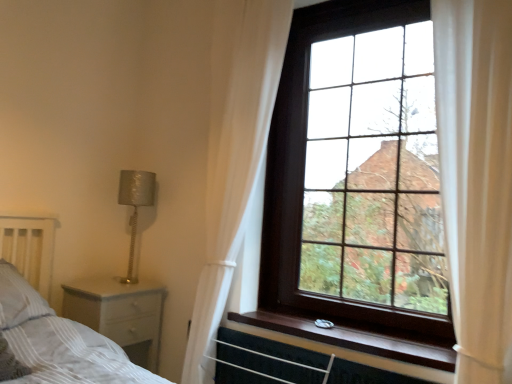
Question: Is white sheer curtain at right, the second curtain from the back, a part of white striped pillow at lower left?

Choices:
 (A) no
 (B) yes

Answer: (A)

Question: Is white striped pillow at lower left further to camera compared to white sheer curtain at right, the second curtain from the back?

Choices:
 (A) no
 (B) yes

Answer: (B)

Question: Does white striped pillow at lower left have a greater height compared to white sheer curtain at right, the second curtain from the back?

Choices:
 (A) yes
 (B) no

Answer: (B)

Question: Can you confirm if white striped pillow at lower left is shorter than white sheer curtain at right, positioned as the first curtain in front-to-back order?

Choices:
 (A) yes
 (B) no

Answer: (A)

Question: Is white striped pillow at lower left to the right of white sheer curtain at right, positioned as the first curtain in front-to-back order, from the viewer's perspective?

Choices:
 (A) no
 (B) yes

Answer: (A)

Question: From the image's perspective, is white striped pillow at lower left under white sheer curtain at right, placed as the 1th curtain when sorted from right to left?

Choices:
 (A) no
 (B) yes

Answer: (B)

Question: Considering the relative sizes of white sheer curtain at right, placed as the 1th curtain when sorted from right to left, and white sheer curtain at upper right, placed as the 2th curtain when sorted from right to left, in the image provided, is white sheer curtain at right, placed as the 1th curtain when sorted from right to left, thinner than white sheer curtain at upper right, placed as the 2th curtain when sorted from right to left,?

Choices:
 (A) yes
 (B) no

Answer: (A)

Question: Does white sheer curtain at right, placed as the 1th curtain when sorted from right to left, appear on the left side of white sheer curtain at upper right, which is the first curtain from back to front?

Choices:
 (A) yes
 (B) no

Answer: (B)

Question: From a real-world perspective, is white sheer curtain at right, placed as the 1th curtain when sorted from right to left, located higher than white sheer curtain at upper right, which is the first curtain from back to front?

Choices:
 (A) yes
 (B) no

Answer: (A)

Question: Does white sheer curtain at right, the second curtain from the back, turn towards white sheer curtain at upper right, placed as the 2th curtain when sorted from right to left?

Choices:
 (A) yes
 (B) no

Answer: (B)

Question: Considering the relative sizes of white sheer curtain at right, which is counted as the 2th curtain, starting from the left, and white sheer curtain at upper right, arranged as the 2th curtain when viewed from the front, in the image provided, is white sheer curtain at right, which is counted as the 2th curtain, starting from the left, shorter than white sheer curtain at upper right, arranged as the 2th curtain when viewed from the front,?

Choices:
 (A) no
 (B) yes

Answer: (B)

Question: Does white sheer curtain at right, which is counted as the 2th curtain, starting from the left, have a smaller size compared to white sheer curtain at upper right, the 1th curtain from the left?

Choices:
 (A) no
 (B) yes

Answer: (B)

Question: Is wooden at upper right shorter than silver textured lamp at left?

Choices:
 (A) yes
 (B) no

Answer: (A)